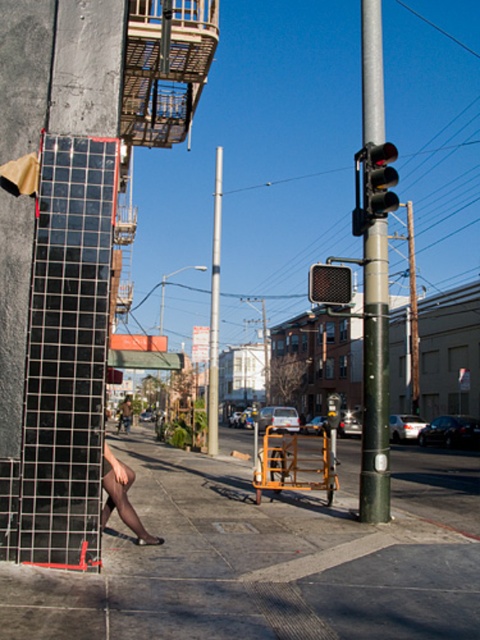
You are standing at point (362, 204) and want to walk to point (364, 353). Which direction should you face to move towards your destination?

You should face forward because point (364, 353) is in front of point (362, 204).

You are standing at the center of the street and want to locate the green metallic pole at center. According to the coordinates provided, in which direction should you look to find it?

The green metallic pole at center is located at coordinates point (x=374, y=378), which means you should look towards the lower right direction from the center of the image.